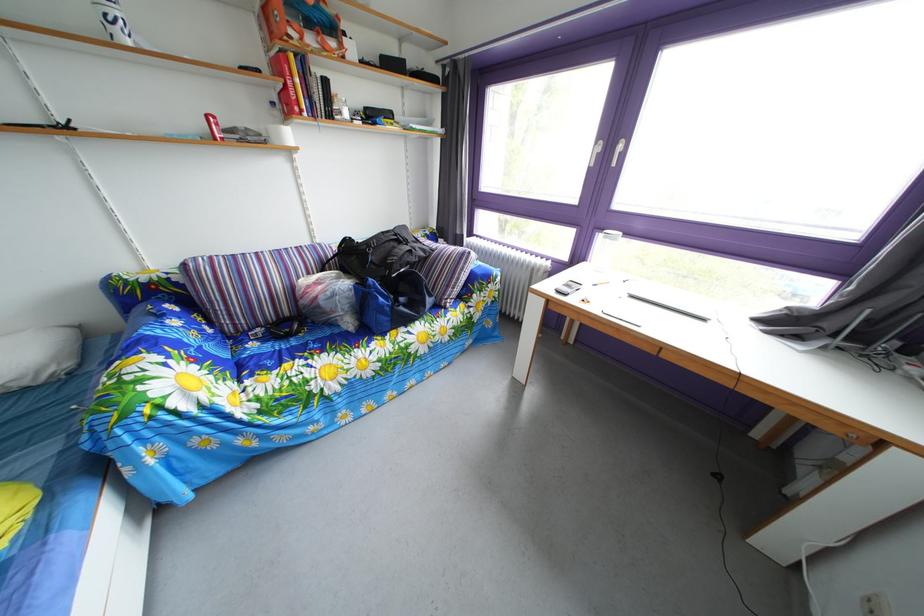
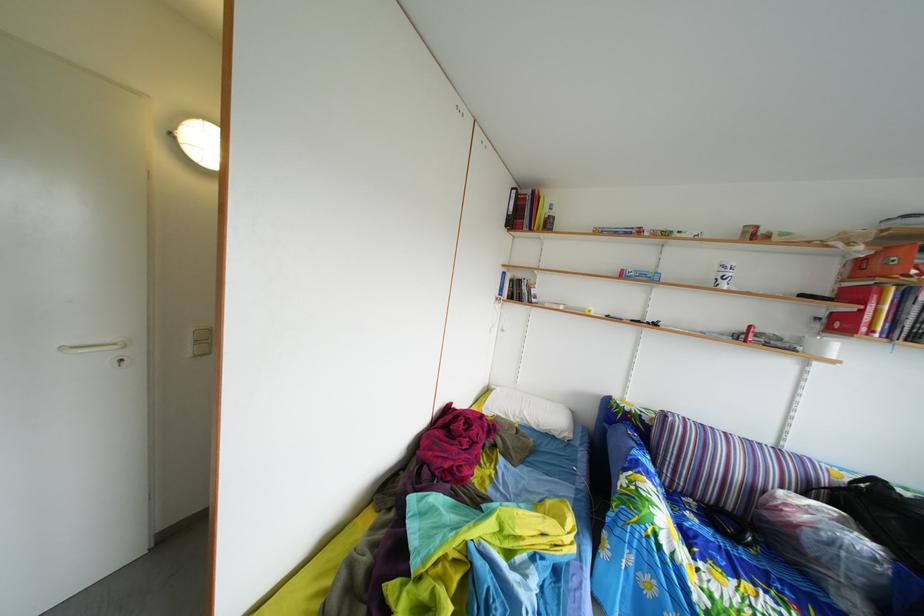
The point at (298, 322) is marked in the first image. Where is the corresponding point in the second image?

(739, 516)